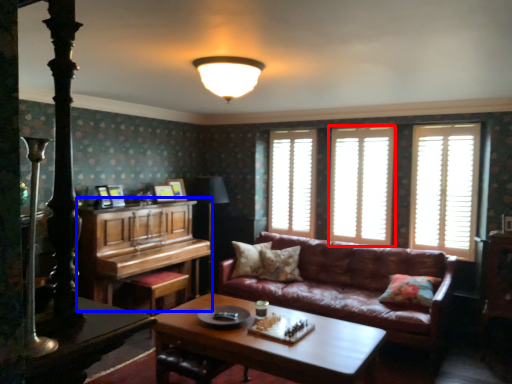
Question: Which of the following is the farthest to the observer, window (highlighted by a red box) or piano (highlighted by a blue box)?

Choices:
 (A) window
 (B) piano

Answer: (A)